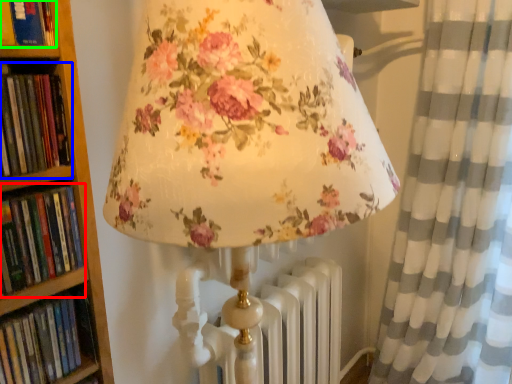
Question: Which object is positioned farthest from book (highlighted by a red box)? Select from book (highlighted by a blue box) and book (highlighted by a green box).

Choices:
 (A) book
 (B) book

Answer: (B)